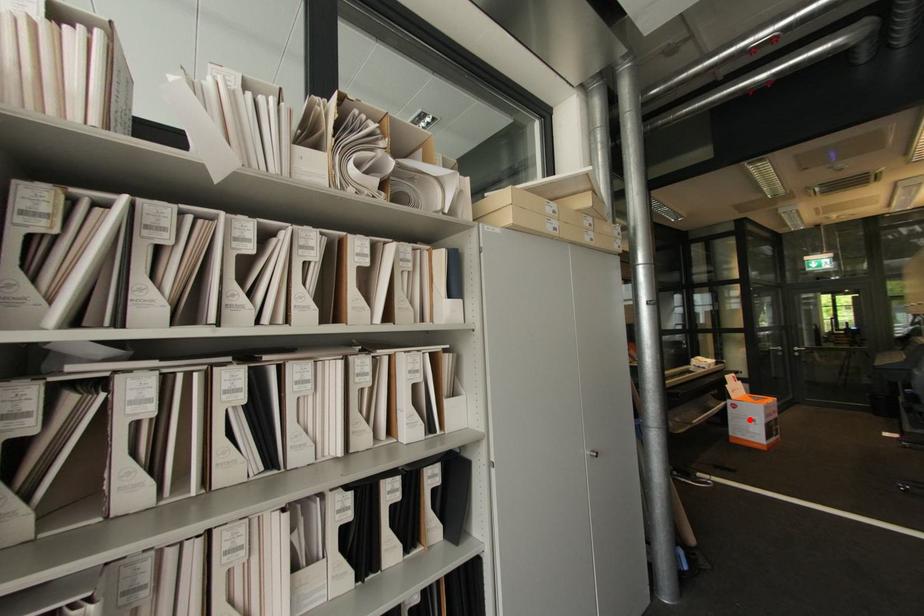
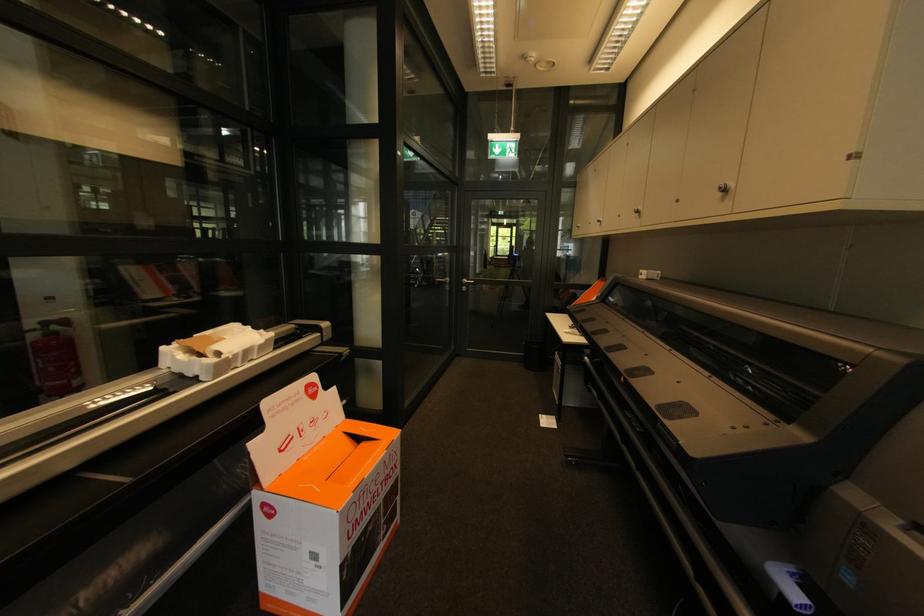
The point at the highlighted location is marked in the first image. Where is the corresponding point in the second image?

(299, 549)